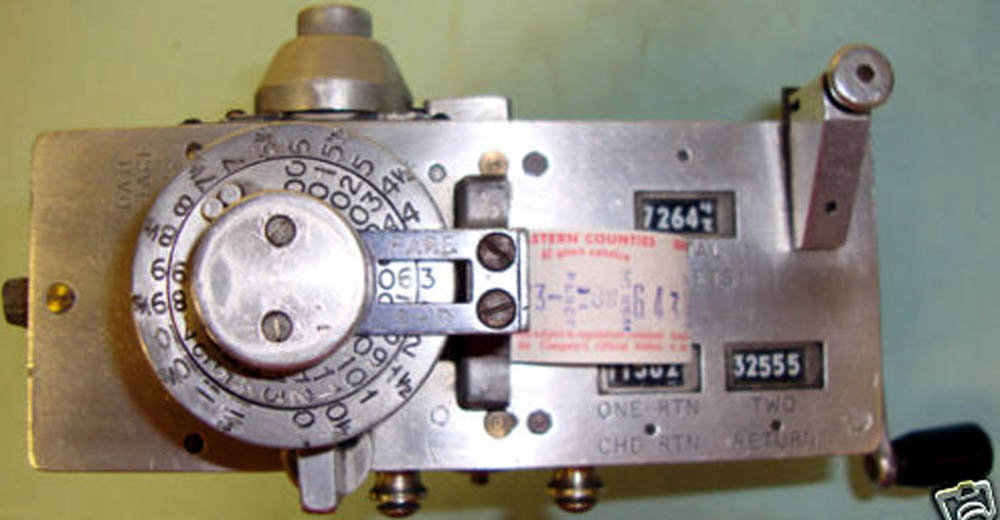
Where is `time clock`? The image size is (1000, 520). time clock is located at coordinates (563, 181).